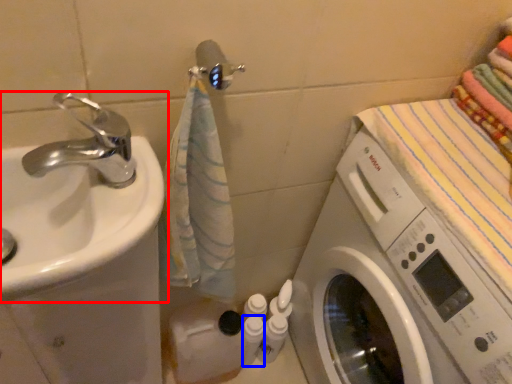
Question: Which point is further to the camera, sink (highlighted by a red box) or toiletry (highlighted by a blue box)?

Choices:
 (A) sink
 (B) toiletry

Answer: (B)